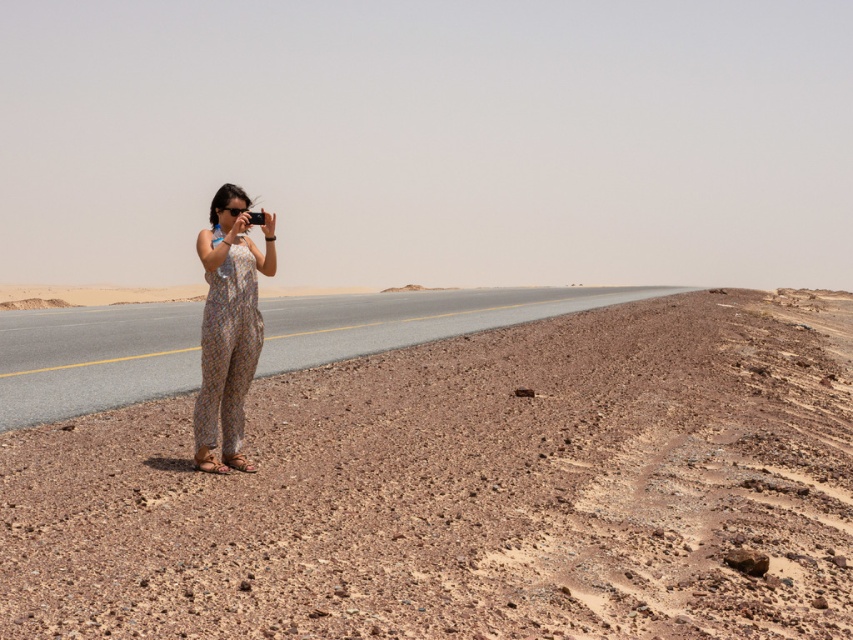
You are a photographer standing on the road in the desert. You want to step onto the brown gravel desert at lower left to get a better angle for your shot. Given that your camera bag is 2 meters long when extended, will you have enough space to move forward without the bag hitting the road?

The distance between you and the brown gravel desert at lower left is 3.75 meters. Since your camera bag is 2 meters long, you have enough space to move forward as 3.75 meters is greater than 2 meters.